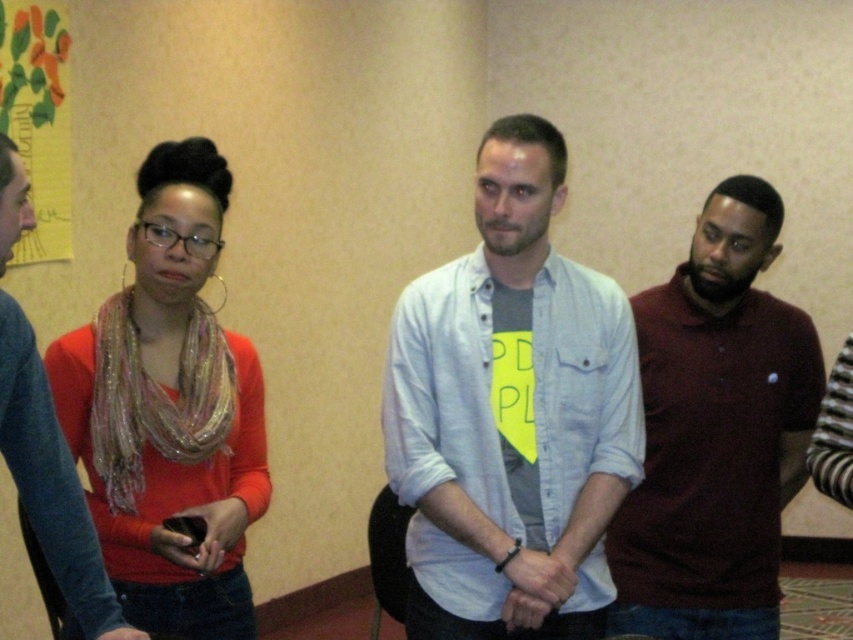
You are organizing a photo shoot and need to position two models wearing the matte orange sweater at left and maroon polo shirt at right. The minimum distance required between them for the shot is 1.2 meters. Based on the current distance, will they need to move farther apart?

The matte orange sweater at left is currently 1.06 meters from the maroon polo shirt at right. Since the required distance is 1.2 meters, they need to move approximately 0.14 meters farther apart to meet the requirement.